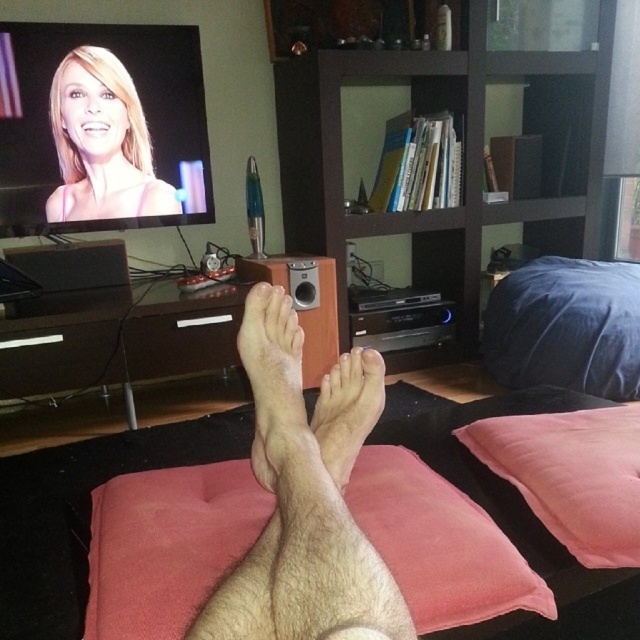
Looking at this image, you are looking at the scene from the person on the couch. There are two points in the image labeled as point 1 at coordinates point (620,566) and point 2 at coordinates point (272,408). Which point is closer to you?

Point (272,408) is closer to you because point (620,566) is further to the camera than point (272,408).